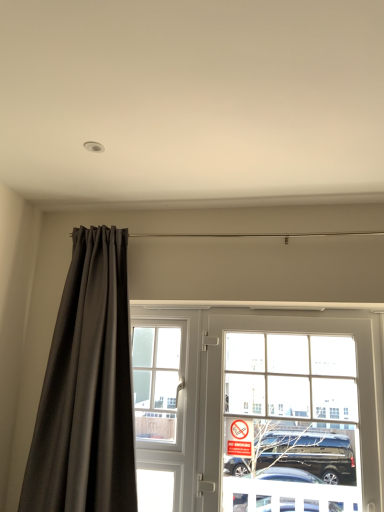
Question: Is clear glass door at center a part of red plastic sign at center?

Choices:
 (A) yes
 (B) no

Answer: (B)

Question: Is red plastic sign at center turned away from clear glass door at center?

Choices:
 (A) yes
 (B) no

Answer: (A)

Question: Could you tell me if red plastic sign at center is facing clear glass door at center?

Choices:
 (A) yes
 (B) no

Answer: (A)

Question: Is red plastic sign at center far from clear glass door at center?

Choices:
 (A) no
 (B) yes

Answer: (A)

Question: Is red plastic sign at center bigger than clear glass door at center?

Choices:
 (A) yes
 (B) no

Answer: (B)

Question: Is clear glass window at center taller or shorter than matte black curtain at left?

Choices:
 (A) short
 (B) tall

Answer: (A)

Question: From the image's perspective, is clear glass window at center located above or below matte black curtain at left?

Choices:
 (A) above
 (B) below

Answer: (B)

Question: Does point (148, 394) appear closer or farther from the camera than point (52, 386)?

Choices:
 (A) farther
 (B) closer

Answer: (A)

Question: In terms of width, does clear glass window at center look wider or thinner when compared to matte black curtain at left?

Choices:
 (A) thin
 (B) wide

Answer: (A)

Question: From a real-world perspective, is clear glass door at center physically located above or below clear glass window at center?

Choices:
 (A) above
 (B) below

Answer: (B)

Question: Considering the positions of point (274, 397) and point (145, 352), is point (274, 397) closer or farther from the camera than point (145, 352)?

Choices:
 (A) closer
 (B) farther

Answer: (A)

Question: Looking at the image, does clear glass door at center seem bigger or smaller compared to clear glass window at center?

Choices:
 (A) small
 (B) big

Answer: (B)

Question: From the image's perspective, is clear glass door at center above or below clear glass window at center?

Choices:
 (A) below
 (B) above

Answer: (A)

Question: From a real-world perspective, is clear glass window at center above or below red plastic sign at center?

Choices:
 (A) below
 (B) above

Answer: (B)

Question: From the image's perspective, is clear glass window at center located above or below red plastic sign at center?

Choices:
 (A) below
 (B) above

Answer: (B)